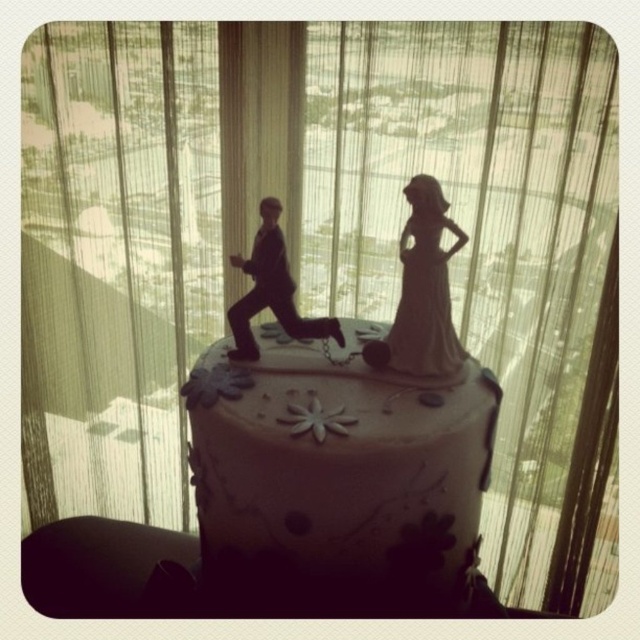
Question: Which of the following is the closest to the observer?

Choices:
 (A) white matte cake at center
 (B) white porcelain bride at center
 (C) matte black figure at center

Answer: (A)

Question: Which point is farther from the camera taking this photo?

Choices:
 (A) (452, 362)
 (B) (280, 305)
 (C) (321, 445)

Answer: (B)

Question: Does matte white figurine at center have a greater width compared to matte black figure at center?

Choices:
 (A) yes
 (B) no

Answer: (A)

Question: In this image, where is matte white figurine at center located relative to white porcelain bride at center?

Choices:
 (A) left
 (B) right

Answer: (A)

Question: Which object is farther from the camera taking this photo?

Choices:
 (A) white porcelain bride at center
 (B) matte black figure at center
 (C) matte white figurine at center

Answer: (B)

Question: Is white matte cake at center bigger than matte white figurine at center?

Choices:
 (A) no
 (B) yes

Answer: (B)